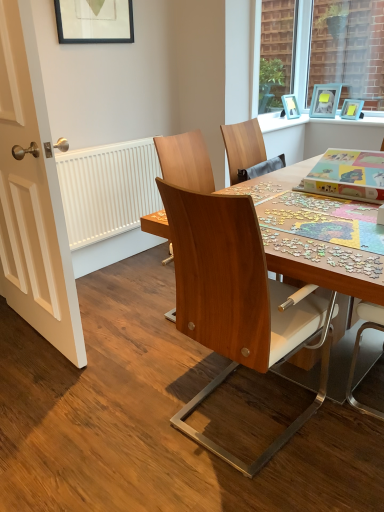
Question: From the image's perspective, is wooden chair at center, acting as the 2th chair starting from the right, over white matte radiator at left?

Choices:
 (A) yes
 (B) no

Answer: (B)

Question: From a real-world perspective, does wooden chair at center, which is the first chair in left-to-right order, stand above white matte radiator at left?

Choices:
 (A) yes
 (B) no

Answer: (A)

Question: Can you confirm if wooden chair at center, acting as the 2th chair starting from the right, is thinner than white matte radiator at left?

Choices:
 (A) no
 (B) yes

Answer: (A)

Question: From a real-world perspective, is wooden chair at center, acting as the 2th chair starting from the right, under white matte radiator at left?

Choices:
 (A) no
 (B) yes

Answer: (A)

Question: Considering the relative sizes of wooden chair at center, acting as the 2th chair starting from the right, and white matte radiator at left in the image provided, is wooden chair at center, acting as the 2th chair starting from the right, shorter than white matte radiator at left?

Choices:
 (A) no
 (B) yes

Answer: (A)

Question: Is the position of wooden chair at center, acting as the 2th chair starting from the right, more distant than that of white matte radiator at left?

Choices:
 (A) no
 (B) yes

Answer: (A)

Question: Can you confirm if wooden chair at center, the second chair when ordered from left to right, is shorter than white matte radiator at left?

Choices:
 (A) yes
 (B) no

Answer: (A)

Question: Does wooden chair at center, the second chair when ordered from left to right, have a smaller size compared to white matte radiator at left?

Choices:
 (A) no
 (B) yes

Answer: (A)

Question: Is wooden chair at center, which appears as the 1th chair when viewed from the right, further to the viewer compared to white matte radiator at left?

Choices:
 (A) yes
 (B) no

Answer: (B)

Question: Is white matte radiator at left inside wooden chair at center, the second chair when ordered from left to right?

Choices:
 (A) no
 (B) yes

Answer: (A)

Question: Considering the relative positions of wooden chair at center, which appears as the 1th chair when viewed from the right, and white matte radiator at left in the image provided, is wooden chair at center, which appears as the 1th chair when viewed from the right, in front of white matte radiator at left?

Choices:
 (A) no
 (B) yes

Answer: (B)

Question: Is wooden chair at center, which appears as the 1th chair when viewed from the right, facing towards white matte radiator at left?

Choices:
 (A) yes
 (B) no

Answer: (B)

Question: From the image's perspective, is matte blue picture frame at upper right, the 2th picture frame when ordered from back to front, located beneath white painted wood door at left?

Choices:
 (A) yes
 (B) no

Answer: (B)